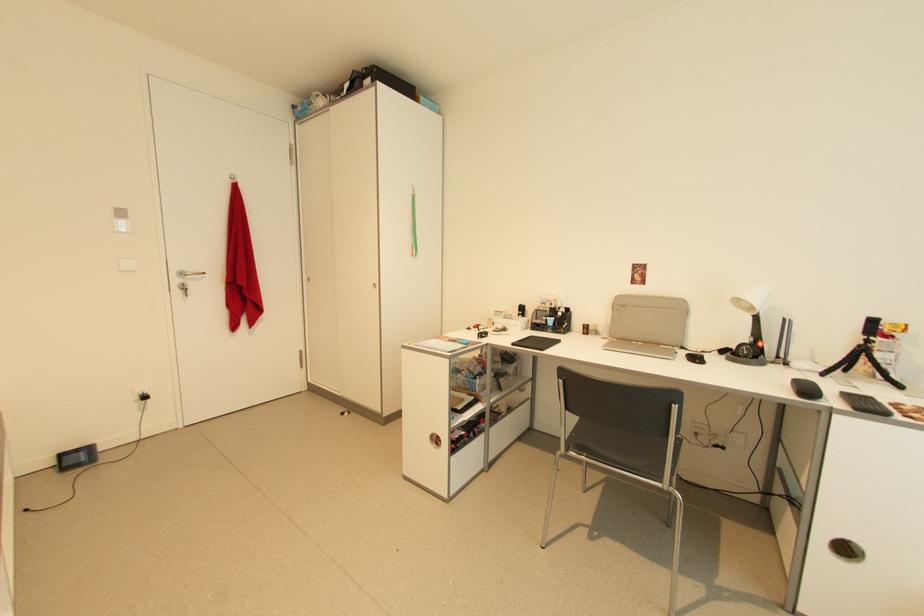
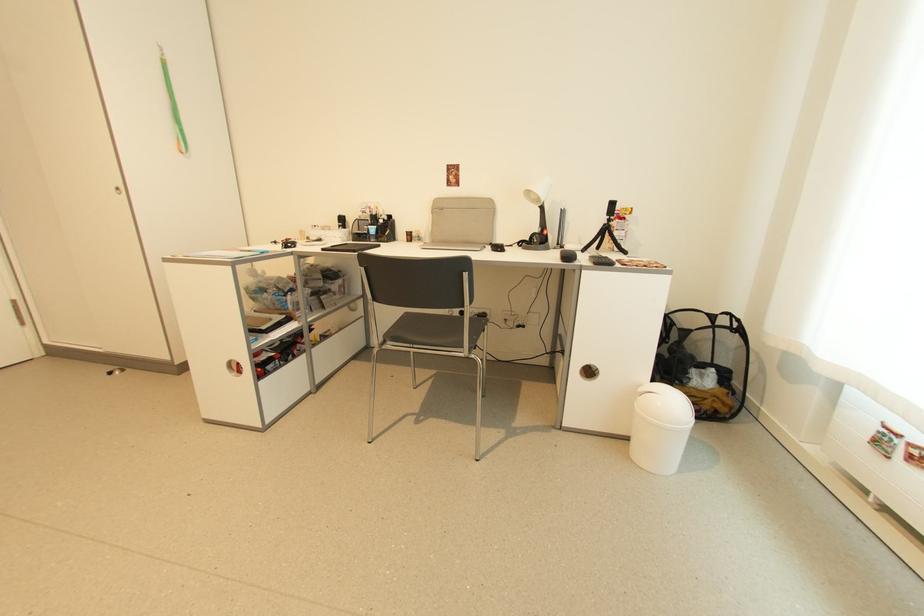
Find the pixel in the second image that matches pixel 418 253 in the first image.

(185, 146)